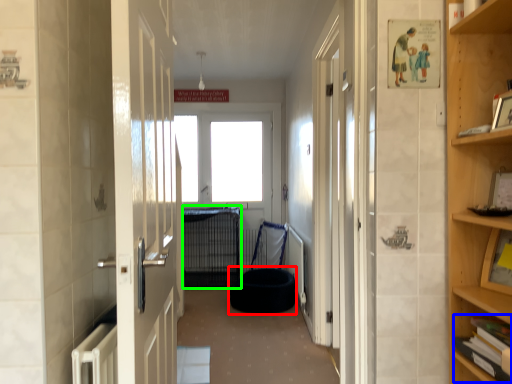
Question: Considering the real-world distances, which object is closest to dog bed (highlighted by a red box)? book (highlighted by a blue box) or cage (highlighted by a green box).

Choices:
 (A) book
 (B) cage

Answer: (B)